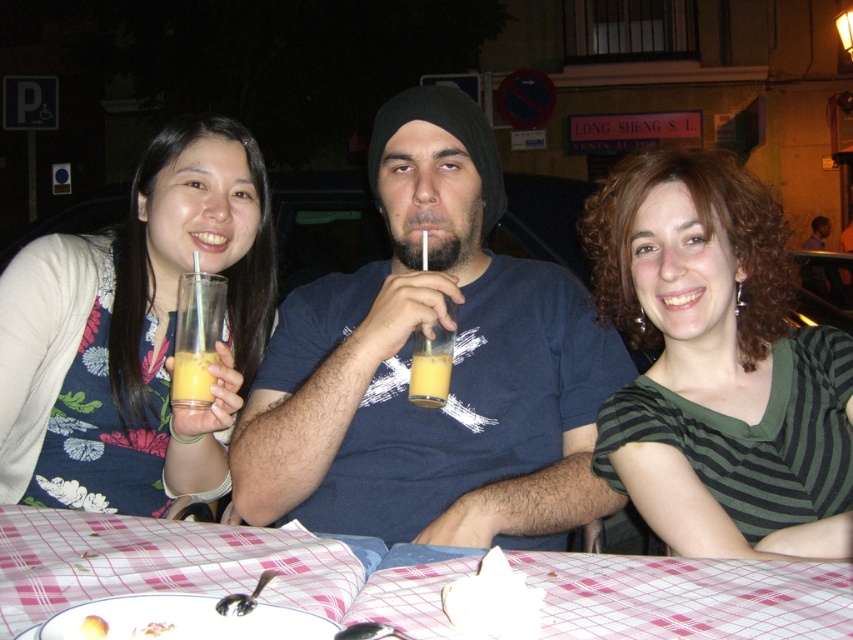
Question: Which of the following is the closest to the observer?

Choices:
 (A) (498, 557)
 (B) (440, 388)

Answer: (A)

Question: Is floral fabric dress at left above yellow matte juice glass at center?

Choices:
 (A) yes
 (B) no

Answer: (A)

Question: Which point is closer to the camera?

Choices:
 (A) pink checkered tablecloth at lower center
 (B) yellow matte juice glass at center
 (C) yellow matte cake at lower left
 (D) translucent glass at center

Answer: (C)

Question: Can you confirm if pink checkered tablecloth at lower center is bigger than yellow matte cake at lower left?

Choices:
 (A) no
 (B) yes

Answer: (B)

Question: Is green striped shirt at center bigger than translucent glass at center?

Choices:
 (A) yes
 (B) no

Answer: (A)

Question: Which is nearer to the translucent glass juice at center?

Choices:
 (A) yellow matte juice glass at center
 (B) matte blue t-shirt at center
 (C) pink checkered tablecloth at lower center
 (D) green striped shirt at center

Answer: (B)